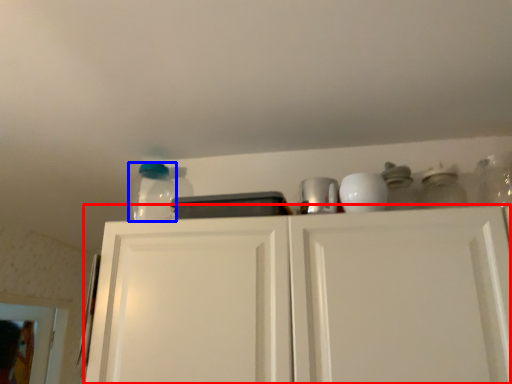
Question: Which of the following is the closest to the observer, cabinetry (highlighted by a red box) or glass jar (highlighted by a blue box)?

Choices:
 (A) cabinetry
 (B) glass jar

Answer: (A)